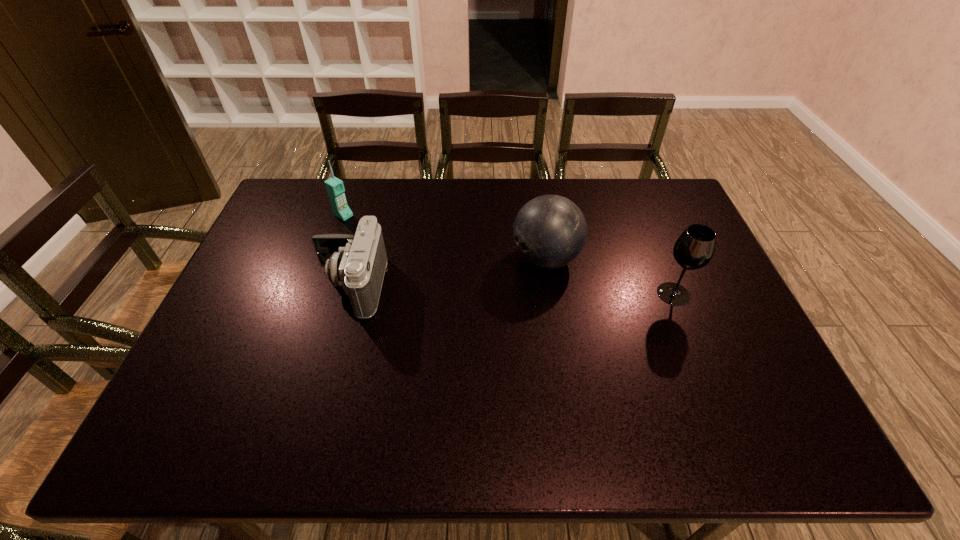
This screenshot has width=960, height=540. I want to click on free space that is in between the camera and the second object from right to left, so click(x=448, y=272).

You are a GUI agent. You are given a task and a screenshot of the screen. Output one action in this format:
    pyautogui.click(x=<x>, y=<y>)
    Task: Click on the free spot between the camera and the rightmost object
    
    Given the screenshot: What is the action you would take?
    pyautogui.click(x=512, y=290)

The image size is (960, 540). What are the coordinates of `object identified as the third closest to the bowling ball` in the screenshot? It's located at (335, 189).

Locate an element on the screen. The image size is (960, 540). object that stands as the second closest to the second object from right to left is located at coordinates (357, 262).

I want to click on vacant region that satisfies the following two spatial constraints: 1. on the front side of the shortest object; 2. at the front of the cellular telephone with an open lens cover, so click(x=320, y=286).

This screenshot has width=960, height=540. What are the coordinates of `vacant region that satisfies the following two spatial constraints: 1. on the front side of the rightmost object; 2. on the left side of the bowling ball` in the screenshot? It's located at [x=551, y=294].